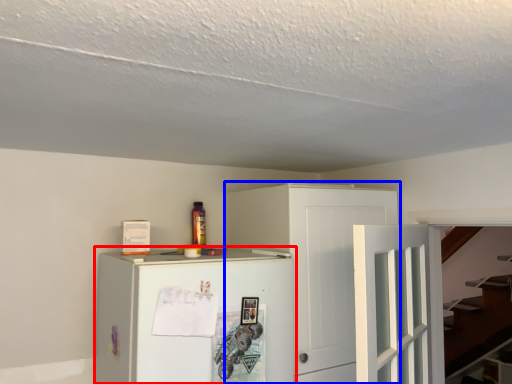
Question: Which of the following is the closest to the observer, refrigerator (highlighted by a red box) or cabinetry (highlighted by a blue box)?

Choices:
 (A) refrigerator
 (B) cabinetry

Answer: (A)